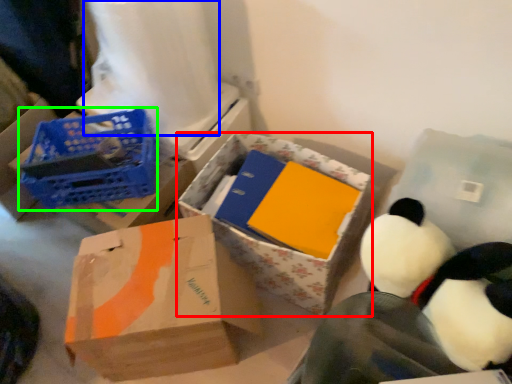
Question: Estimate the real-world distances between objects in this image. Which object is closer to box (highlighted by a red box), toilet paper (highlighted by a blue box) or basket (highlighted by a green box)?

Choices:
 (A) toilet paper
 (B) basket

Answer: (B)